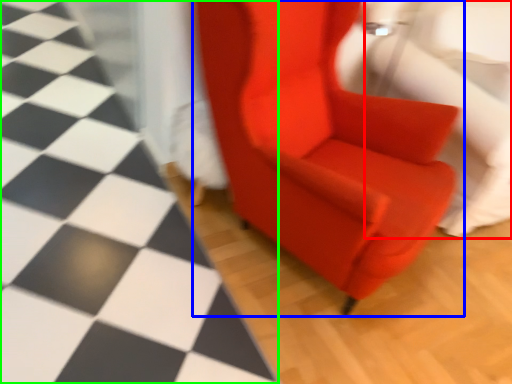
Question: Which is nearer to the swivel chair (highlighted by a red box)? chair (highlighted by a blue box) or tile (highlighted by a green box).

Choices:
 (A) chair
 (B) tile

Answer: (A)